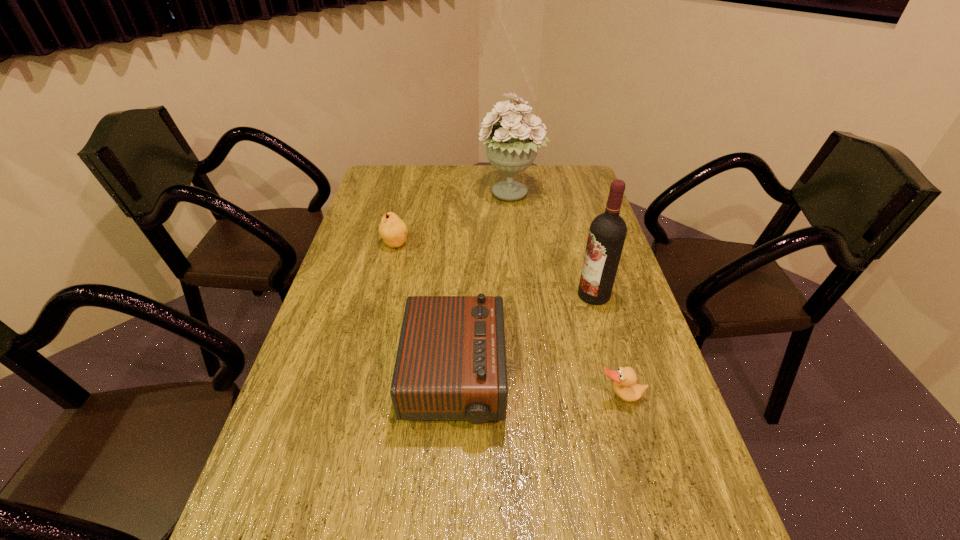
In order to click on vacant space at the far left corner of the desktop in this screenshot , I will do `click(391, 176)`.

You are a GUI agent. You are given a task and a screenshot of the screen. Output one action in this format:
    pyautogui.click(x=<x>, y=<y>)
    Task: Click on the free point at the far right corner
    Image resolution: width=960 pixels, height=540 pixels.
    Given the screenshot: What is the action you would take?
    pyautogui.click(x=585, y=172)

Where is `vacant space in between the wine bottle and the farthest object`? vacant space in between the wine bottle and the farthest object is located at coordinates (552, 245).

What are the coordinates of `empty location between the wine bottle and the second shortest object` in the screenshot? It's located at (494, 269).

This screenshot has height=540, width=960. I want to click on free spot between the bouquet and the radio receiver, so click(482, 287).

Locate an element on the screen. The width and height of the screenshot is (960, 540). free spot between the pear and the duck is located at coordinates (508, 320).

At what (x,y) coordinates should I click in order to perform the action: click on vacant area that lies between the farthest object and the wine bottle. Please return your answer as a coordinate pair (x, y). The image size is (960, 540). Looking at the image, I should click on [x=552, y=245].

The height and width of the screenshot is (540, 960). Identify the location of free area in between the pear and the wine bottle. (494, 269).

The height and width of the screenshot is (540, 960). I want to click on empty space that is in between the shortest object and the third tallest object, so click(538, 388).

Image resolution: width=960 pixels, height=540 pixels. I want to click on empty location between the bouquet and the second farthest object, so (x=453, y=219).